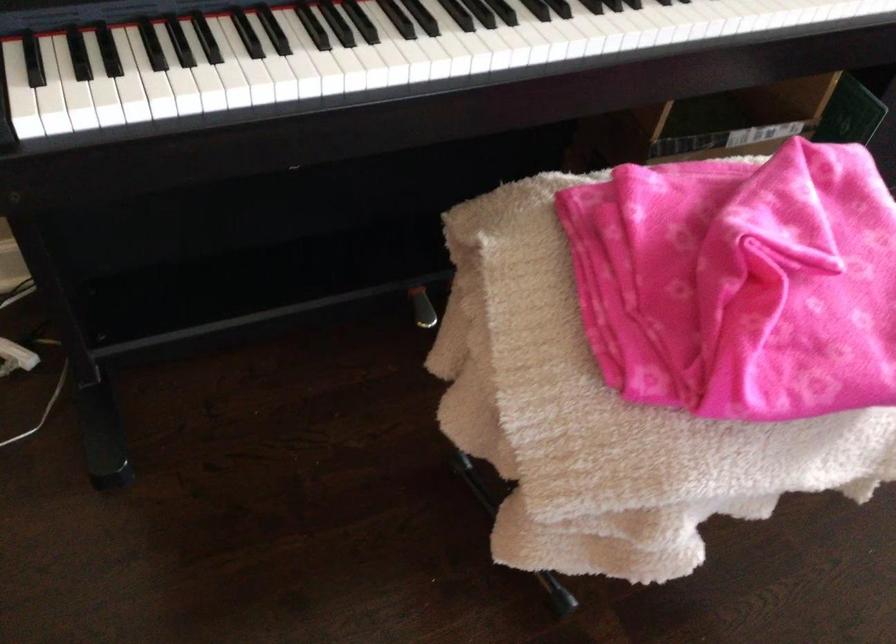
Describe the element at coordinates (87, 80) in the screenshot. I see `a piano keys` at that location.